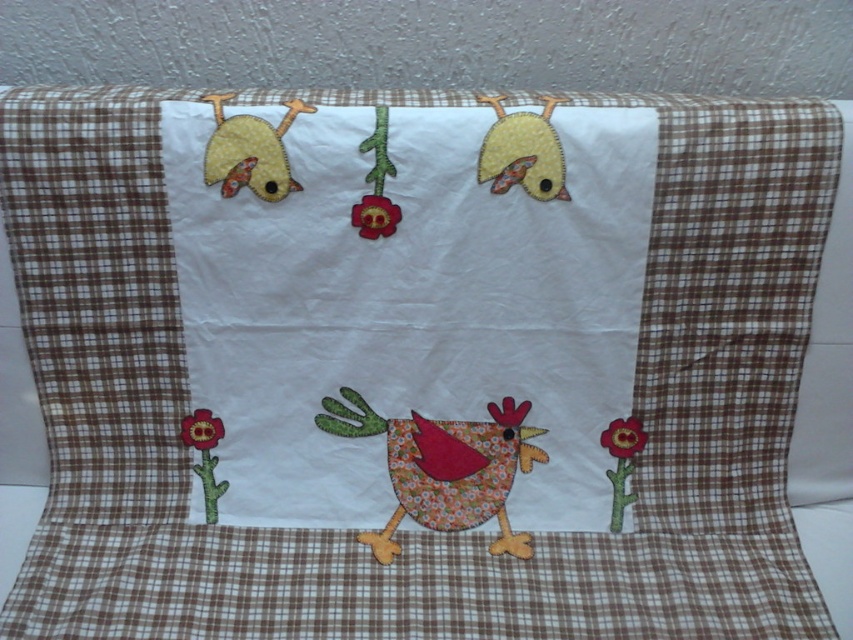
You are holding a camera and want to take a photo of the handmade quilt. If you stand at a position where the distance between your camera and the point at coordinates point (x=395, y=420) is exactly 1.08 meters, will you be able to capture the entire quilt in your shot?

Yes, because the distance between the camera and point (x=395, y=420) is exactly 1.08 meters, which is the required distance to capture the entire quilt in the photo.